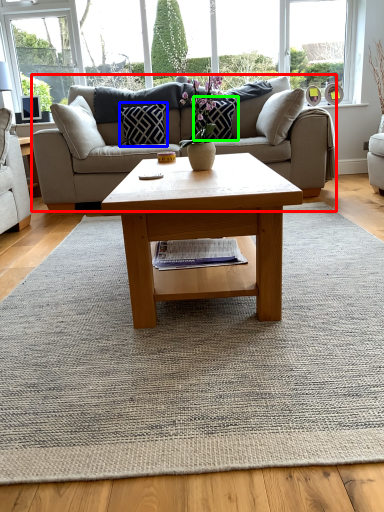
Question: Based on their relative distances, which object is farther from studio couch (highlighted by a red box)? Choose from pillow (highlighted by a blue box) and pillow (highlighted by a green box).

Choices:
 (A) pillow
 (B) pillow

Answer: (B)